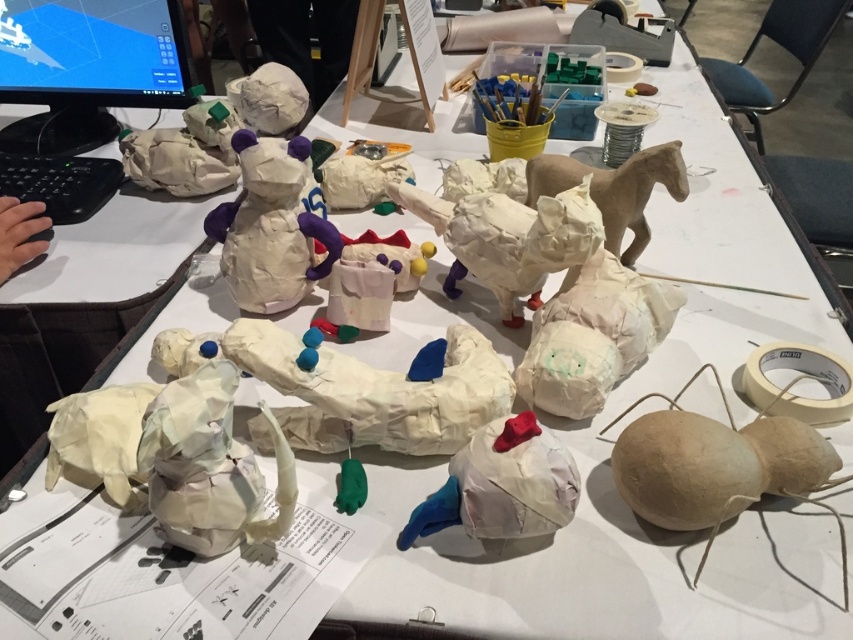
Question: Does white crumpled paper dog at center appear over white paper mache animal at center?

Choices:
 (A) yes
 (B) no

Answer: (B)

Question: Is white crumpled paper dog at center smaller than white crumpled paper horse at center?

Choices:
 (A) no
 (B) yes

Answer: (B)

Question: Estimate the real-world distances between objects in this image. Which object is closer to the matte brown spider at lower right?

Choices:
 (A) white crumpled paper horse at center
 (B) white crumpled paper dog at center
 (C) brown paper horse at upper right
 (D) matte papier-mâché mouse at center

Answer: (A)

Question: In this image, where is white paper mache animal at center located relative to white crumpled paper horse at center?

Choices:
 (A) above
 (B) below

Answer: (B)

Question: Among these objects, which one is farthest from the camera?

Choices:
 (A) matte papier-mâché mouse at center
 (B) matte brown spider at lower right

Answer: (A)

Question: Which object is farther from the camera taking this photo?

Choices:
 (A) white crumpled paper horse at center
 (B) white paper mache animal at center
 (C) white crumpled paper dog at center

Answer: (A)